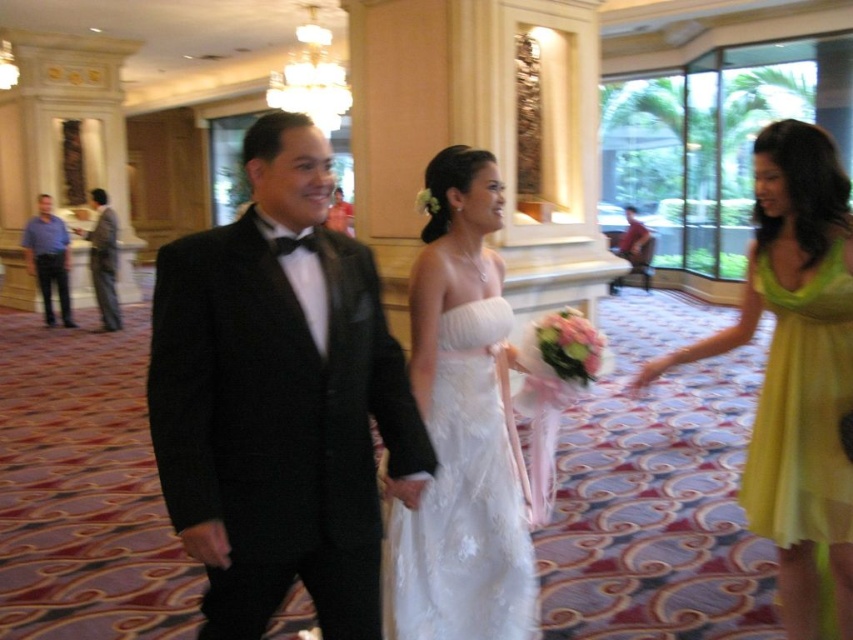
You are a photographer positioned at the back of the wedding venue. You need to capture a photo of the white satin dress at center and the blue shirt at left. Based on their heights, which one should you focus on first to ensure both are in frame?

The white satin dress at center has a lesser height compared to the blue shirt at left. Therefore, to ensure both are in frame, you should focus on the blue shirt at left first since it is taller and will occupy more of the upper part of the frame.

You are a photographer positioned at the back of the venue. You need to capture a photo of both the shiny black tuxedo at center and the blue shirt at left in the same frame. The camera you are using has a maximum focal length that allows capturing objects up to 8 meters apart. Will you be able to include both subjects in a single shot?

The shiny black tuxedo at center and blue shirt at left are 8.55 meters apart, which exceeds the camera maximum focal length of 8 meters. Therefore, you cannot include both subjects in a single shot.